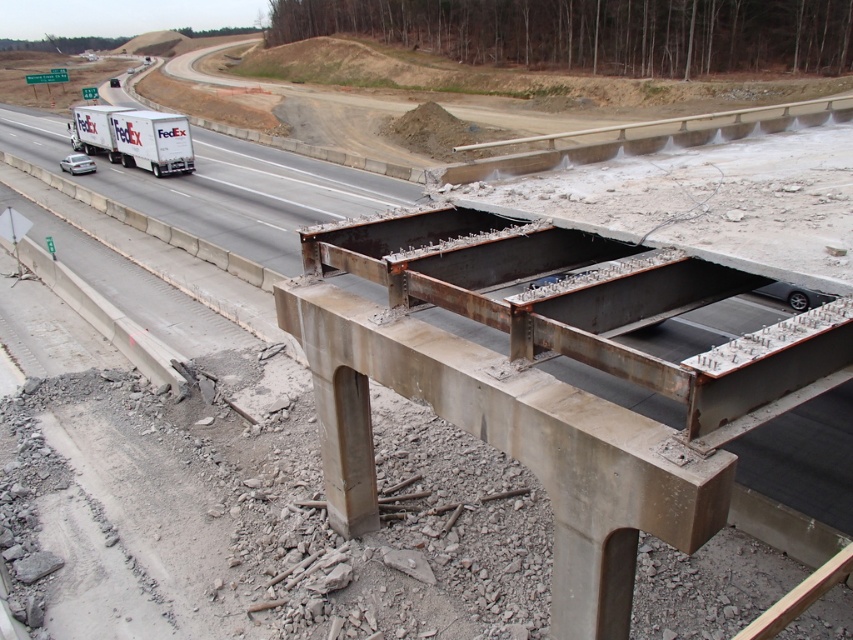
You are a driver approaching the rusty metal bridge at center with a white matte truck at left similar in size to yours. Can your truck safely pass through the bridge?

The rusty metal bridge at center is narrower than the white matte truck at left, so your truck may not safely pass through the bridge if it is as wide as the truck mentioned.

You are a pedestrian standing on the sidewalk near the construction site. You see the white matte truck at left and the matte white trailer truck at left. Which one is closer to the unfinished concrete bridge?

The white matte truck at left is positioned under matte white trailer truck at left, so the white matte truck at left is closer to the unfinished concrete bridge.

You are a traffic officer observing the highway scene. You notice two vehicles on the left side of the highway. Which one is bigger between the white matte truck at left and the matte white trailer truck at left?

The white matte truck at left is larger in size compared to the matte white trailer truck at left according to the description.